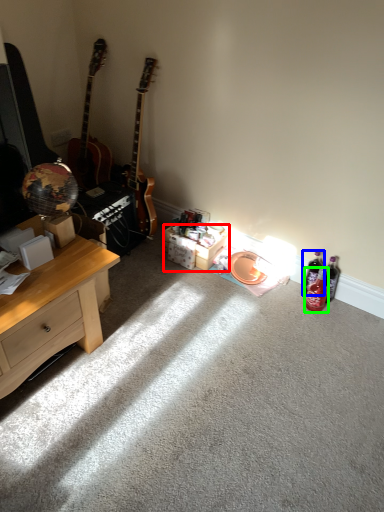
Question: Considering the real-world distances, which object is closest to box (highlighted by a red box)? bottle (highlighted by a blue box) or bottle (highlighted by a green box).

Choices:
 (A) bottle
 (B) bottle

Answer: (A)